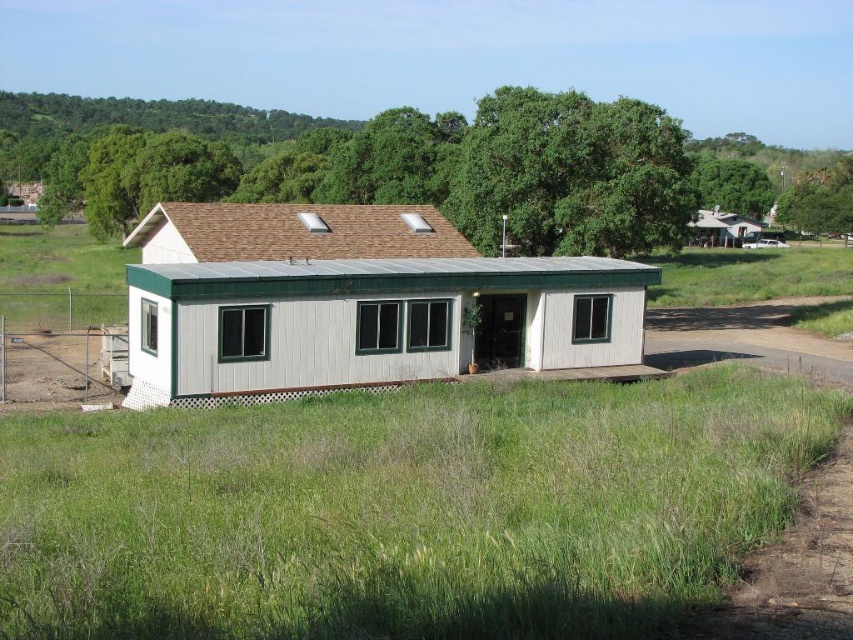
Question: Which of the following is the farthest from the observer?

Choices:
 (A) (734, 369)
 (B) (473, 332)

Answer: (B)

Question: Is green grass at lower center positioned behind white wood cabin at center?

Choices:
 (A) no
 (B) yes

Answer: (A)

Question: Which object is farther from the camera taking this photo?

Choices:
 (A) white wood cabin at center
 (B) green grass at lower center

Answer: (A)

Question: Which of the following is the closest to the observer?

Choices:
 (A) (270, 317)
 (B) (728, 556)

Answer: (B)

Question: Is green grass at lower center closer to camera compared to white wood cabin at center?

Choices:
 (A) yes
 (B) no

Answer: (A)

Question: Is green grass at lower center to the left of white wood cabin at center from the viewer's perspective?

Choices:
 (A) no
 (B) yes

Answer: (A)